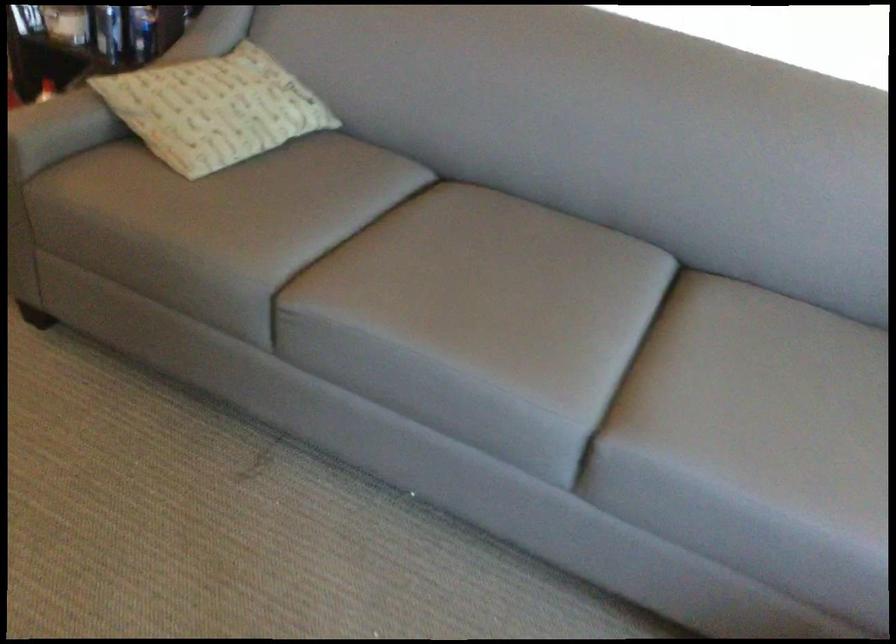
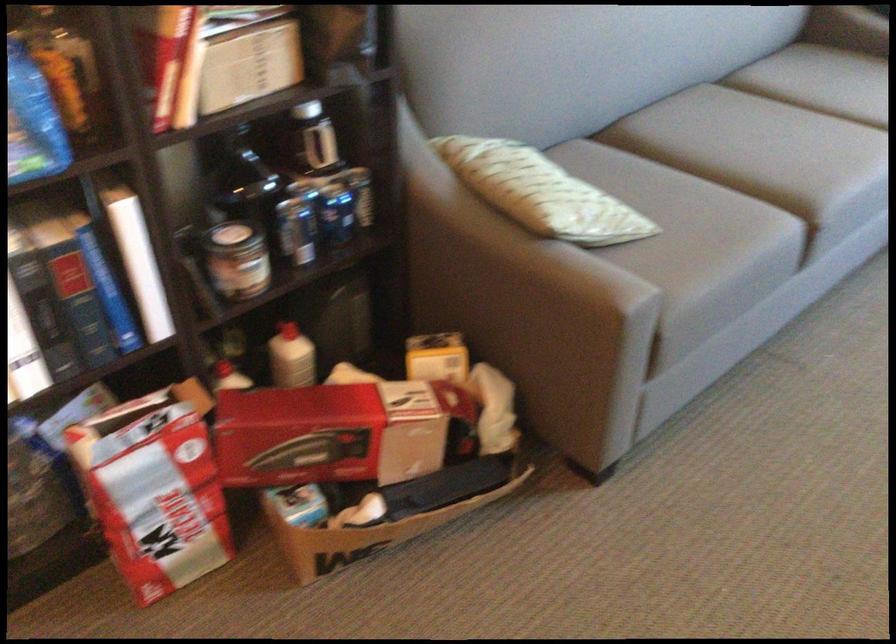
Locate, in the second image, the point that corresponds to point 162,84 in the first image.

(537, 192)